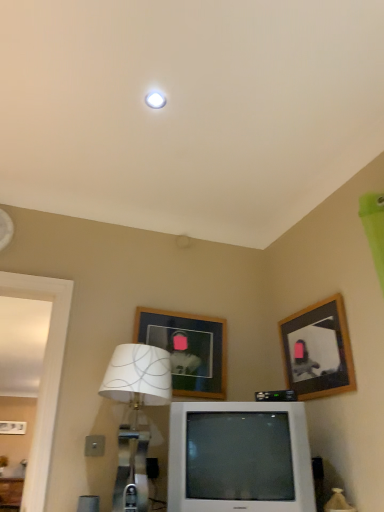
Question: Does white plastic television at center have a greater width compared to wooden picture frame at upper right, the first picture frame from the right?

Choices:
 (A) no
 (B) yes

Answer: (B)

Question: Is white plastic television at center thinner than wooden picture frame at upper right, which is counted as the second picture frame, starting from the left?

Choices:
 (A) no
 (B) yes

Answer: (A)

Question: Is there a large distance between white plastic television at center and wooden picture frame at upper right, the first picture frame from the right?

Choices:
 (A) yes
 (B) no

Answer: (B)

Question: From the image's perspective, is white plastic television at center under wooden picture frame at upper right, the first picture frame from the right?

Choices:
 (A) yes
 (B) no

Answer: (A)

Question: From a real-world perspective, does white plastic television at center stand above wooden picture frame at upper right, the first picture frame from the right?

Choices:
 (A) yes
 (B) no

Answer: (B)

Question: Is white plastic television at center to the left of wooden picture frame at upper right, which is counted as the second picture frame, starting from the left, from the viewer's perspective?

Choices:
 (A) yes
 (B) no

Answer: (A)

Question: Can you confirm if white fabric lampshade at lower center is taller than wooden picture frame at upper center, the first picture frame from the left?

Choices:
 (A) no
 (B) yes

Answer: (B)

Question: Can you confirm if white fabric lampshade at lower center is bigger than wooden picture frame at upper center, the first picture frame from the left?

Choices:
 (A) no
 (B) yes

Answer: (B)

Question: Considering the relative positions of white fabric lampshade at lower center and wooden picture frame at upper center, which appears as the 2th picture frame when viewed from the right, in the image provided, is white fabric lampshade at lower center behind wooden picture frame at upper center, which appears as the 2th picture frame when viewed from the right,?

Choices:
 (A) no
 (B) yes

Answer: (A)

Question: Considering the relative sizes of white fabric lampshade at lower center and wooden picture frame at upper center, which appears as the 2th picture frame when viewed from the right, in the image provided, is white fabric lampshade at lower center wider than wooden picture frame at upper center, which appears as the 2th picture frame when viewed from the right,?

Choices:
 (A) no
 (B) yes

Answer: (B)

Question: Is white fabric lampshade at lower center at the left side of wooden picture frame at upper center, the first picture frame from the left?

Choices:
 (A) no
 (B) yes

Answer: (B)

Question: From the image's perspective, is white fabric lampshade at lower center below wooden picture frame at upper center, the first picture frame from the left?

Choices:
 (A) no
 (B) yes

Answer: (B)

Question: Is wooden picture frame at upper center, which appears as the 2th picture frame when viewed from the right, thinner than wooden picture frame at upper right, the first picture frame from the right?

Choices:
 (A) no
 (B) yes

Answer: (B)